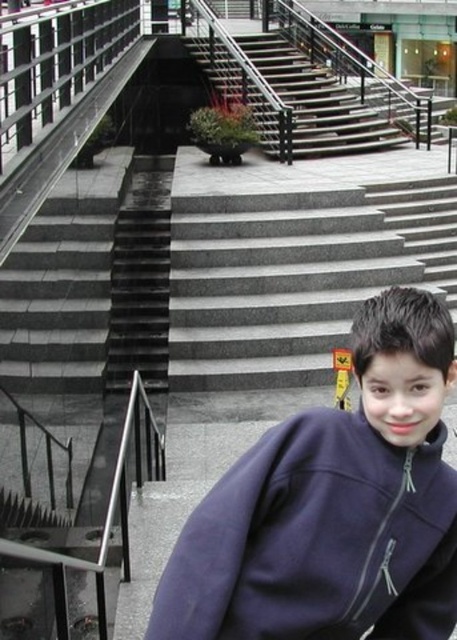
Question: Which of the following is the farthest from the observer?

Choices:
 (A) dark gray concrete stairs at center
 (B) dark blue fleece at center

Answer: (A)

Question: Among these points, which one is farthest from the camera?

Choices:
 (A) (187, 612)
 (B) (325, 122)

Answer: (B)

Question: Which of the following is the closest to the observer?

Choices:
 (A) dark blue fleece at center
 (B) dark gray concrete stairs at center

Answer: (A)

Question: Can you confirm if dark blue fleece at center is positioned to the right of dark gray concrete stairs at center?

Choices:
 (A) yes
 (B) no

Answer: (A)

Question: Is dark blue fleece at center thinner than dark gray concrete stairs at center?

Choices:
 (A) yes
 (B) no

Answer: (B)

Question: Can you confirm if dark blue fleece at center is wider than dark gray concrete stairs at center?

Choices:
 (A) yes
 (B) no

Answer: (A)